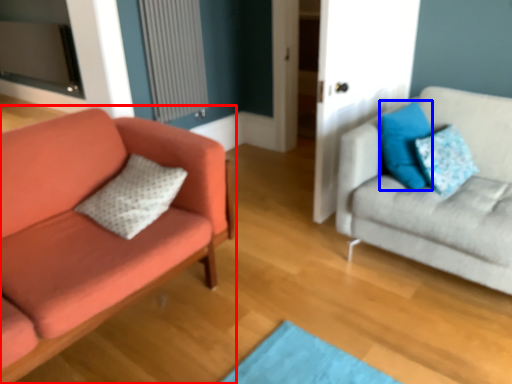
Question: Which object appears farthest to the camera in this image, studio couch (highlighted by a red box) or pillow (highlighted by a blue box)?

Choices:
 (A) studio couch
 (B) pillow

Answer: (B)